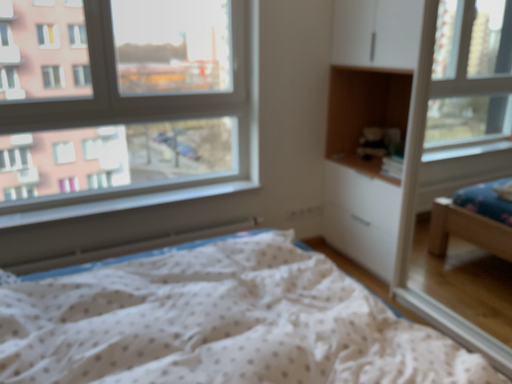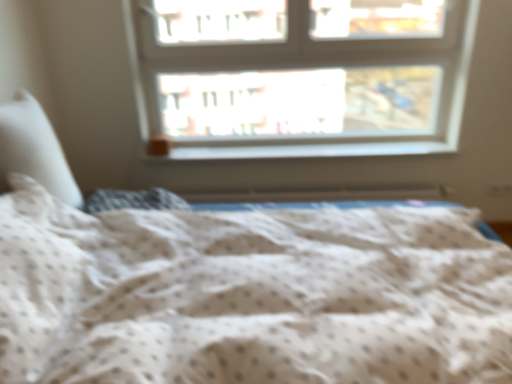
Question: How did the camera likely rotate when shooting the video?

Choices:
 (A) rotated right
 (B) rotated left

Answer: (B)